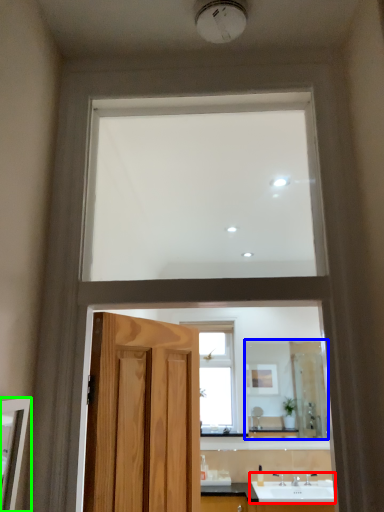
Question: Which object is the closest to the sink (highlighted by a red box)? Choose among these: mirror (highlighted by a blue box) or mirror (highlighted by a green box).

Choices:
 (A) mirror
 (B) mirror

Answer: (A)